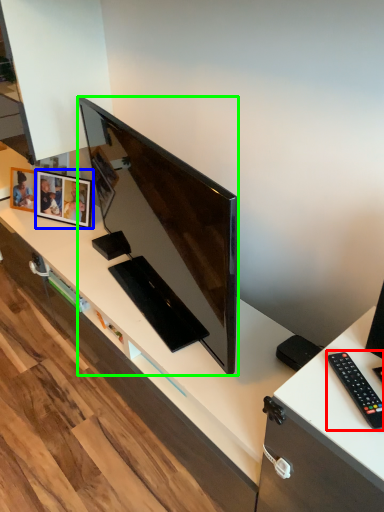
Question: Which is farther away from remote control (highlighted by a red box)? picture frame (highlighted by a blue box) or television (highlighted by a green box)?

Choices:
 (A) picture frame
 (B) television

Answer: (A)